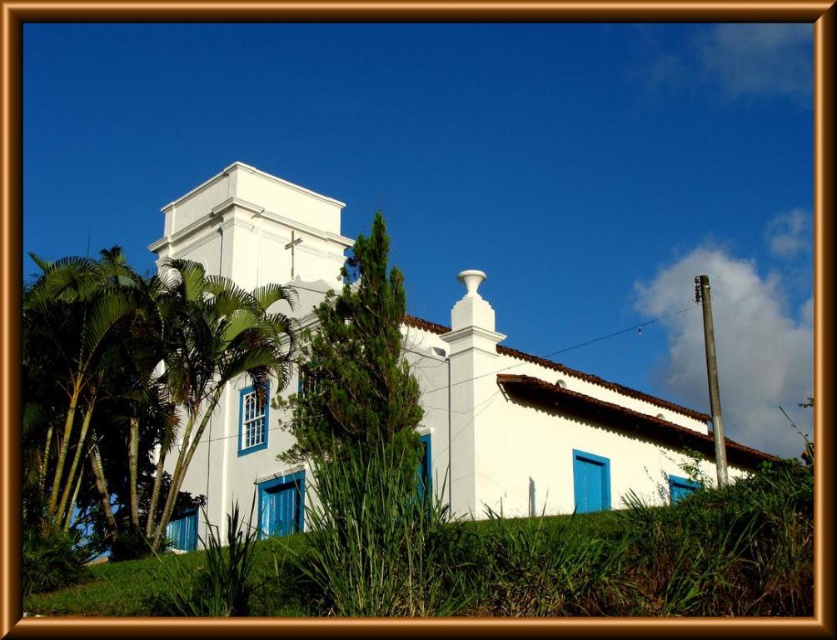
You are a landscape architect planning to install a 10 meter long walkway between the white stucco church at center and the green leafy palm tree at left. Based on the current distance between them, will the walkway fit without needing to adjust the placement of either structure?

The distance between the white stucco church at center and the green leafy palm tree at left is 10.12 meters. Since the walkway is 10 meters long, it will fit with a small gap of 0.12 meters remaining between the two structures.

Based on the photo, you are standing at the base of the church and looking towards the bell tower. There are two points marked on the church wall. One is at point coordinate [270,458] and the other is at point coordinate [121,330]. Which point is closer to you?

Point coordinate [270,458] is further to the viewer than point coordinate [121,330], so the point at [121,330] is closer to you.

You are standing at the point marked by coordinates point (540,426) in the image. Describe the immediate surroundings of this point based on the scene description.

The point (540,426) corresponds to the white stucco church at center. The immediate surroundings include lush green plants and trees like palm trees and tropical foliage, as well as tall grasses and shrubs in the foreground, all situated on a grassy hill under a clear blue sky.